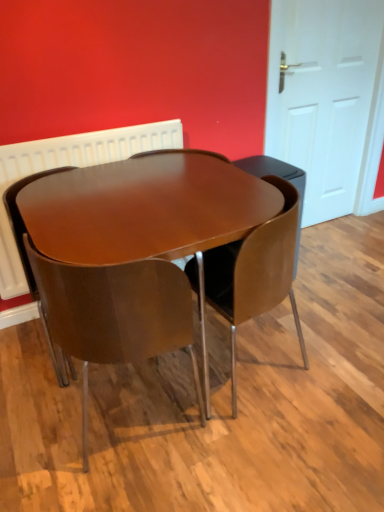
Locate an element on the screen. The height and width of the screenshot is (512, 384). vacant region to the left of matte brown chair at center, the second chair when ordered from right to left is located at coordinates (36, 410).